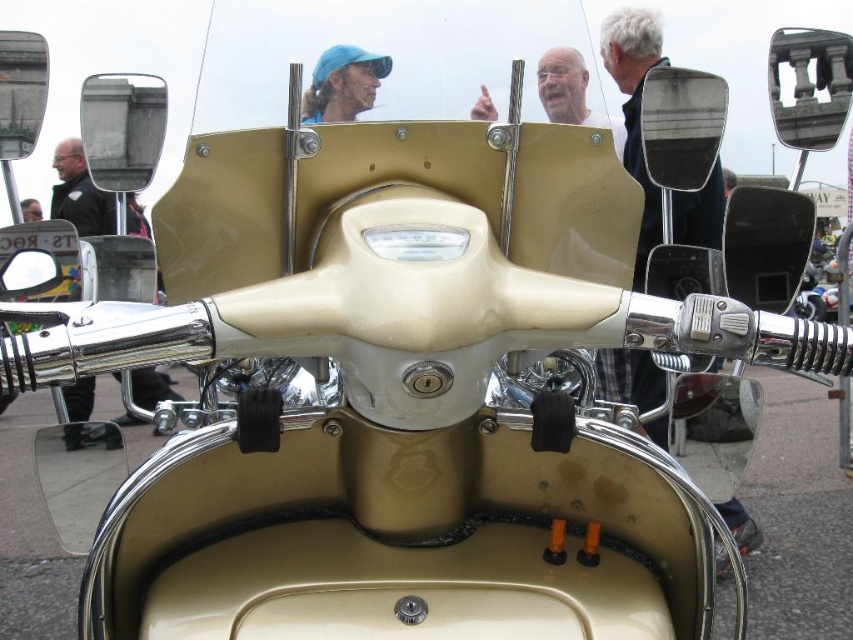
Question: Which object is positioned closest to the matte black helmet at upper left?

Choices:
 (A) smooth beige scooter at center
 (B) gray hair at upper left
 (C) matte blue cap at upper center

Answer: (B)

Question: Is matte blue cap at upper center above smooth beige scooter at center?

Choices:
 (A) no
 (B) yes

Answer: (B)

Question: Which point appears farthest from the camera in this image?

Choices:
 (A) (27, 198)
 (B) (347, 68)
 (C) (479, 108)

Answer: (A)

Question: Can you confirm if gray hair at upper left is bigger than smooth beige scooter at center?

Choices:
 (A) yes
 (B) no

Answer: (A)

Question: Can you confirm if gray hair at upper left is positioned below smooth beige scooter at center?

Choices:
 (A) yes
 (B) no

Answer: (B)

Question: Which point is closer to the camera?

Choices:
 (A) matte blue cap at upper center
 (B) smooth beige scooter at center

Answer: (A)